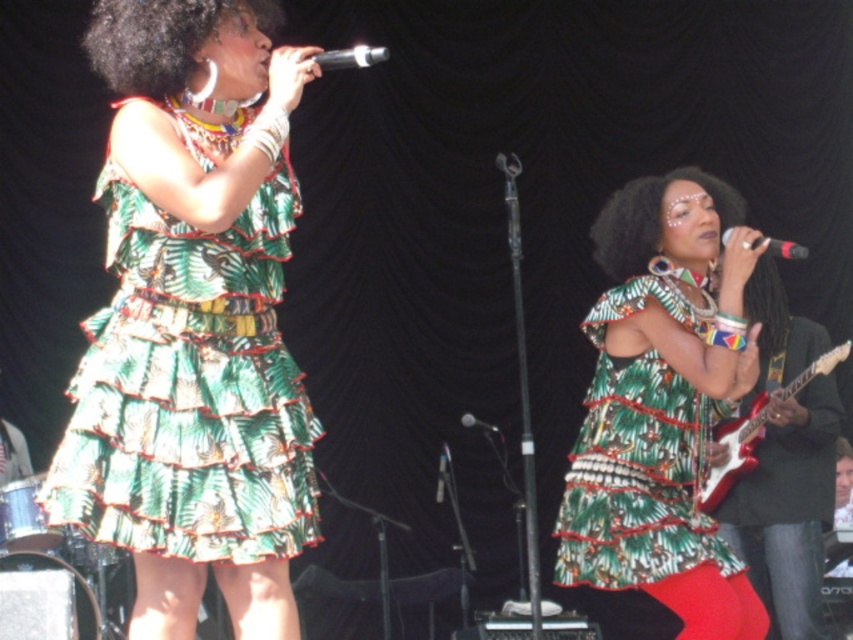
Question: Which of these objects is positioned closest to the black matte microphone at right?

Choices:
 (A) green textured fabric afro at center
 (B) curly hair at upper left

Answer: (A)

Question: Is green leafy fabric dress at left thinner than green textured fabric afro at center?

Choices:
 (A) yes
 (B) no

Answer: (B)

Question: Which object is the farthest from the black plastic microphone at upper center?

Choices:
 (A) green printed dress at center
 (B) curly hair at upper left
 (C) green leafy fabric dress at left

Answer: (A)

Question: Can you confirm if shiny electric guitar at right is positioned above black matte microphone at right?

Choices:
 (A) no
 (B) yes

Answer: (A)

Question: Is curly hair at upper left above shiny electric guitar at right?

Choices:
 (A) no
 (B) yes

Answer: (B)

Question: Among these objects, which one is nearest to the camera?

Choices:
 (A) black matte microphone at right
 (B) curly hair at upper left
 (C) black metallic microphone at center

Answer: (B)